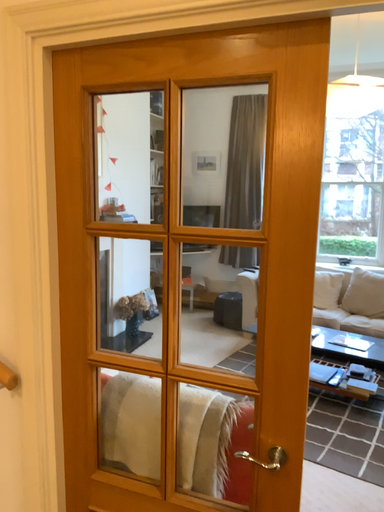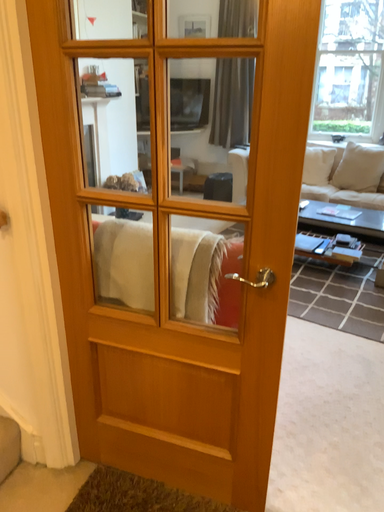
Question: How did the camera likely rotate when shooting the video?

Choices:
 (A) rotated upward
 (B) rotated downward

Answer: (B)